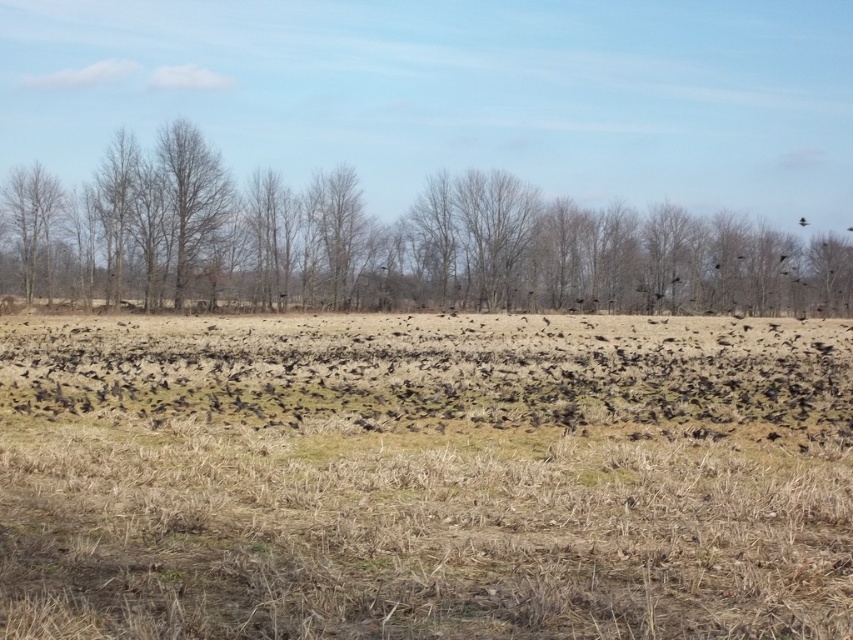
Between bare wood tree at center and bare wood tree at left, which one appears on the right side from the viewer's perspective?

Positioned to the right is bare wood tree at center.

Between bare wood tree at center and bare wood tree at left, which one appears on the left side from the viewer's perspective?

From the viewer's perspective, bare wood tree at left appears more on the left side.

Does point (219, 205) come in front of point (50, 266)?

No, (219, 205) is behind (50, 266).

In order to click on bare wood tree at center in this screenshot , I will do `click(190, 195)`.

The height and width of the screenshot is (640, 853). I want to click on bare branches at center, so click(x=384, y=244).

Where is `bare branches at center`? bare branches at center is located at coordinates coord(384,244).

Which is below, black matte birds at center or bare wood tree at center?

black matte birds at center is below.

Between black matte birds at center and bare wood tree at center, which one appears on the right side from the viewer's perspective?

From the viewer's perspective, black matte birds at center appears more on the right side.

Who is more distant from viewer, (782, 422) or (190, 259)?

The point (190, 259) is more distant.

You are a GUI agent. You are given a task and a screenshot of the screen. Output one action in this format:
    pyautogui.click(x=<x>, y=<y>)
    Task: Click on the black matte birds at center
    
    Given the screenshot: What is the action you would take?
    pyautogui.click(x=434, y=369)